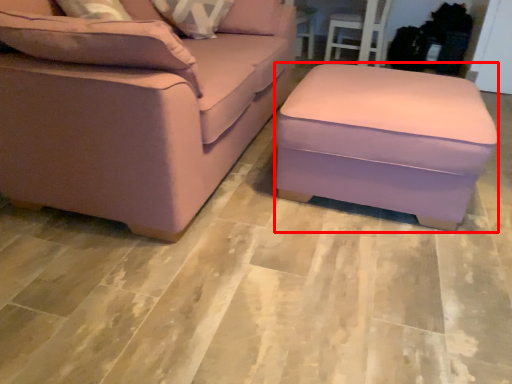
Question: Where is stool (annotated by the red box) located in relation to studio couch in the image?

Choices:
 (A) right
 (B) left

Answer: (A)